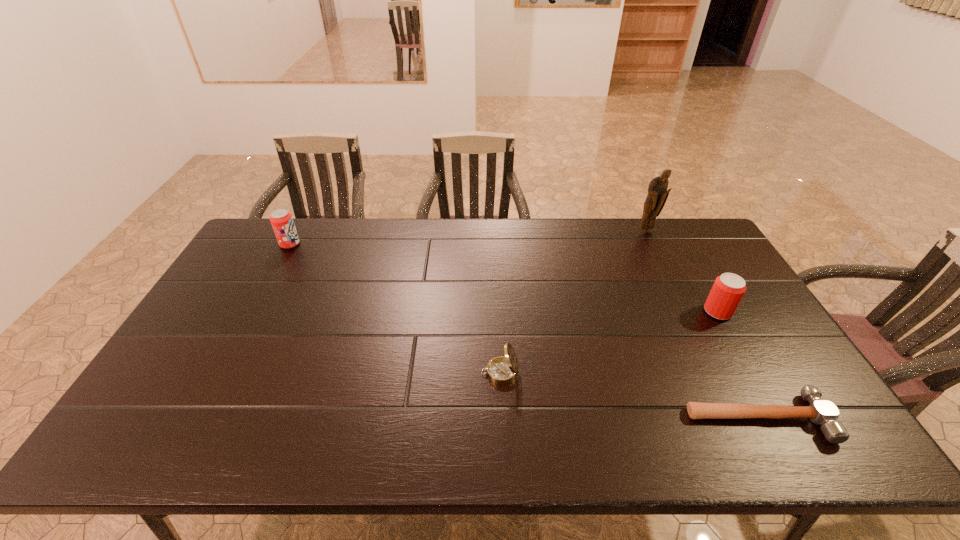
This screenshot has height=540, width=960. Find the location of `beer can that is at the right edge`. beer can that is at the right edge is located at coordinates (728, 289).

You are a GUI agent. You are given a task and a screenshot of the screen. Output one action in this format:
    pyautogui.click(x=<x>, y=<y>)
    Task: Click on the hammer that is at the right edge
    Image resolution: width=960 pixels, height=540 pixels.
    Given the screenshot: What is the action you would take?
    pyautogui.click(x=820, y=412)

Locate an element on the screen. The width and height of the screenshot is (960, 540). object at the far left corner is located at coordinates (281, 220).

Locate an element on the screen. The height and width of the screenshot is (540, 960). object at the near right corner is located at coordinates (820, 412).

Where is `blank space at the far edge`? This screenshot has height=540, width=960. blank space at the far edge is located at coordinates (389, 245).

The image size is (960, 540). What are the coordinates of `vacant space at the near edge of the desktop` in the screenshot? It's located at (299, 424).

Identify the location of vacant space at the left edge of the desktop. The image size is (960, 540). click(195, 344).

At what (x,y) coordinates should I click in order to perform the action: click on vacant space at the right edge of the desktop. Please return your answer as a coordinate pair (x, y). This screenshot has height=540, width=960. Looking at the image, I should click on (742, 386).

The height and width of the screenshot is (540, 960). In order to click on vacant point at the far right corner in this screenshot , I will do `click(658, 226)`.

Image resolution: width=960 pixels, height=540 pixels. Identify the location of free area in between the beer can and the compass. (609, 342).